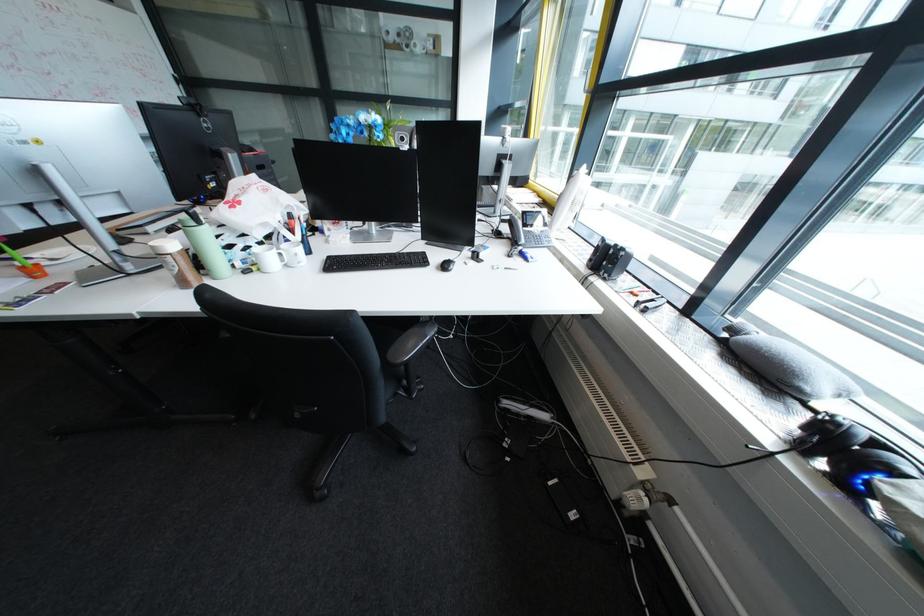
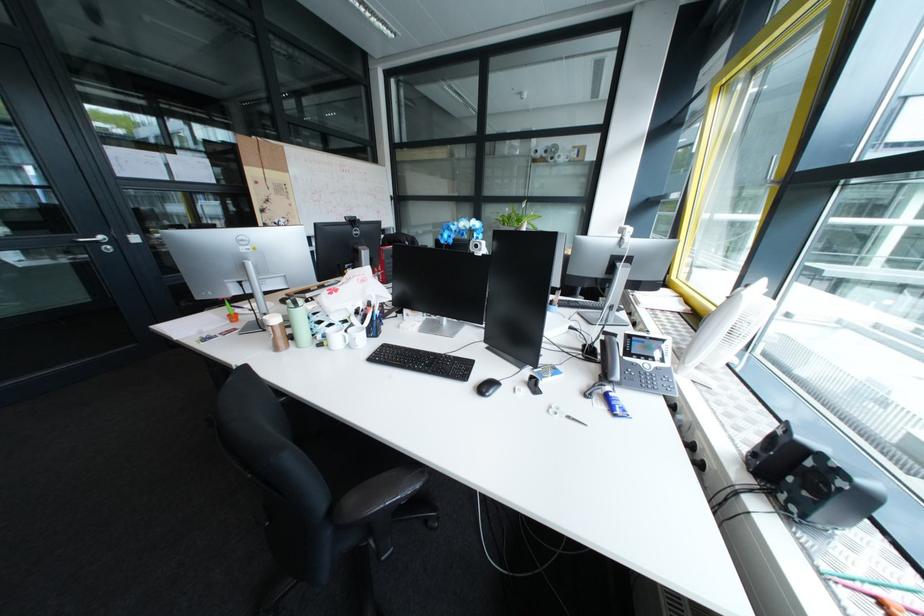
In the second image, find the point that corresponds to [451,268] in the first image.

(488, 387)